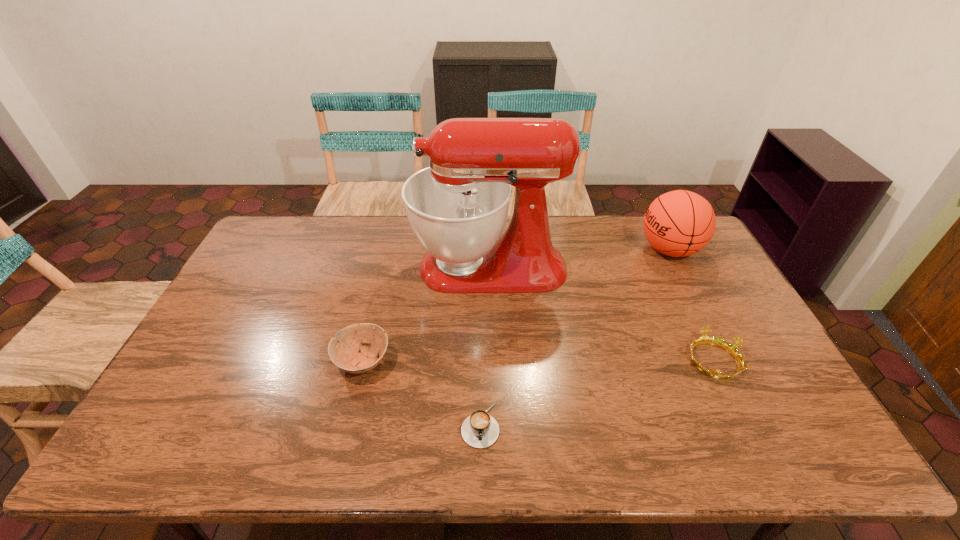
Identify the location of vacant region between the tallest object and the cappuccino. 485,346.

Find the location of a particular element. The width and height of the screenshot is (960, 540). vacant area that lies between the tallest object and the nearest object is located at coordinates (485, 346).

At what (x,y) coordinates should I click in order to perform the action: click on free space between the tallest object and the bowl. Please return your answer as a coordinate pair (x, y). The height and width of the screenshot is (540, 960). Looking at the image, I should click on (426, 314).

You are a GUI agent. You are given a task and a screenshot of the screen. Output one action in this format:
    pyautogui.click(x=<x>, y=<y>)
    Task: Click on the empty space between the crown and the mixer
    
    Given the screenshot: What is the action you would take?
    pyautogui.click(x=601, y=314)

You are a GUI agent. You are given a task and a screenshot of the screen. Output one action in this format:
    pyautogui.click(x=<x>, y=<y>)
    Task: Click on the object that is the second closest to the nearest object
    This screenshot has height=540, width=960.
    Given the screenshot: What is the action you would take?
    pyautogui.click(x=457, y=207)

Locate an element on the screen. the second closest object to the crown is located at coordinates (457, 207).

This screenshot has height=540, width=960. Identify the location of vacant area that satisfies the following two spatial constraints: 1. at the attachment hub of the tallest object; 2. on the front side of the bowl. (492, 361).

Find the location of a particular element. free space that satisfies the following two spatial constraints: 1. on the side with logo of the second tallest object; 2. on the front side of the crown is located at coordinates (726, 360).

Where is `vacant space that satisfies the following two spatial constraints: 1. on the back side of the crown; 2. at the attachment hub of the mixer`? vacant space that satisfies the following two spatial constraints: 1. on the back side of the crown; 2. at the attachment hub of the mixer is located at coordinates (668, 267).

Find the location of `vacant space that satisfies the following two spatial constraints: 1. on the side with logo of the fourth shortest object; 2. on the front side of the crown`. vacant space that satisfies the following two spatial constraints: 1. on the side with logo of the fourth shortest object; 2. on the front side of the crown is located at coordinates (726, 360).